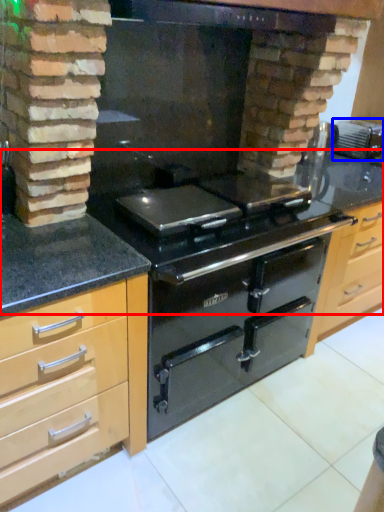
Question: Among these objects, which one is nearest to the camera, counter top (highlighted by a red box) or appliance (highlighted by a blue box)?

Choices:
 (A) counter top
 (B) appliance

Answer: (A)